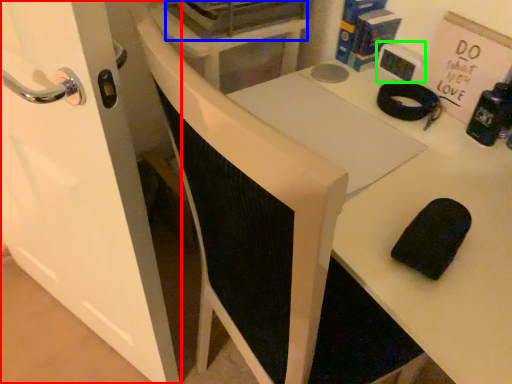
Question: Considering the real-world distances, which object is farthest from door (highlighted by a red box)? appliance (highlighted by a blue box) or appliance (highlighted by a green box)?

Choices:
 (A) appliance
 (B) appliance

Answer: (B)